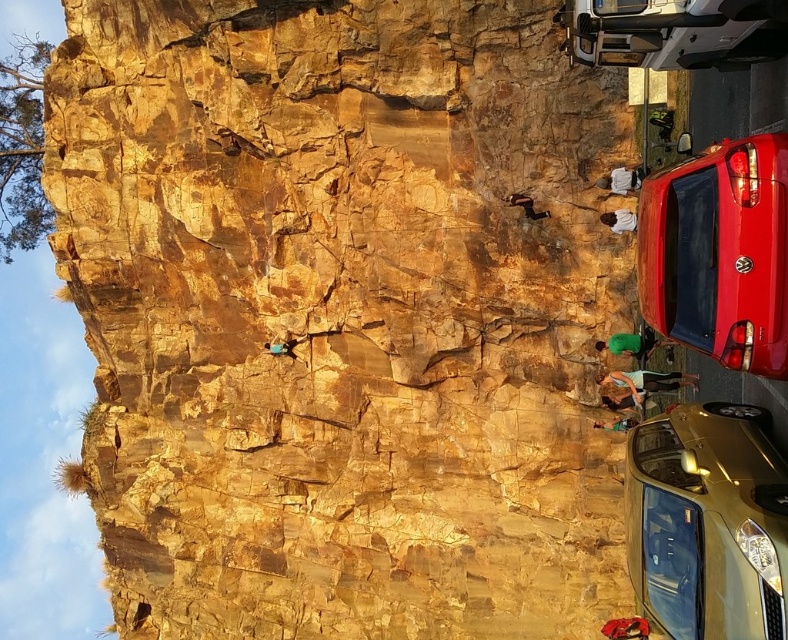
Who is more distant from viewer, [770,637] or [626,340]?

Point [626,340]

Is gold metallic car at lower right smaller than green fabric rock climber at center?

Actually, gold metallic car at lower right might be larger than green fabric rock climber at center.

Identify the location of gold metallic car at lower right. The image size is (788, 640). (707, 524).

Can you confirm if metallic silver van at upper right is wider than smooth skin rock climber at lower right?

Indeed, metallic silver van at upper right has a greater width compared to smooth skin rock climber at lower right.

Identify the location of metallic silver van at upper right. This screenshot has width=788, height=640. (673, 33).

You are a GUI agent. You are given a task and a screenshot of the screen. Output one action in this format:
    pyautogui.click(x=<x>, y=<y>)
    Task: Click on the metallic silver van at upper right
    
    Given the screenshot: What is the action you would take?
    pyautogui.click(x=673, y=33)

Who is taller, shiny red car at right or smooth skin rock climber at lower right?

With more height is shiny red car at right.

Can you confirm if shiny red car at right is positioned to the left of smooth skin rock climber at lower right?

Correct, you'll find shiny red car at right to the left of smooth skin rock climber at lower right.

Between point (710, 166) and point (645, 378), which one is positioned behind?

The point (645, 378) is behind.

Locate an element on the screen. shiny red car at right is located at coordinates (719, 253).